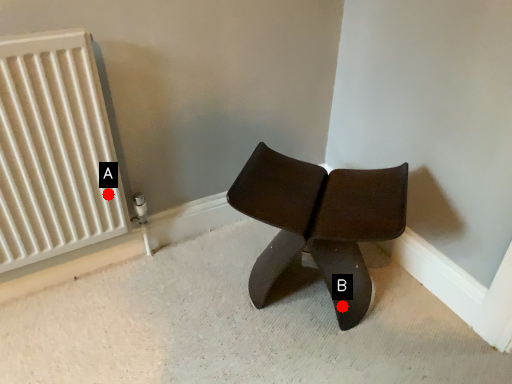
Question: Two points are circled on the image, labeled by A and B beside each circle. Which point is closer to the camera taking this photo?

Choices:
 (A) A is closer
 (B) B is closer

Answer: (B)